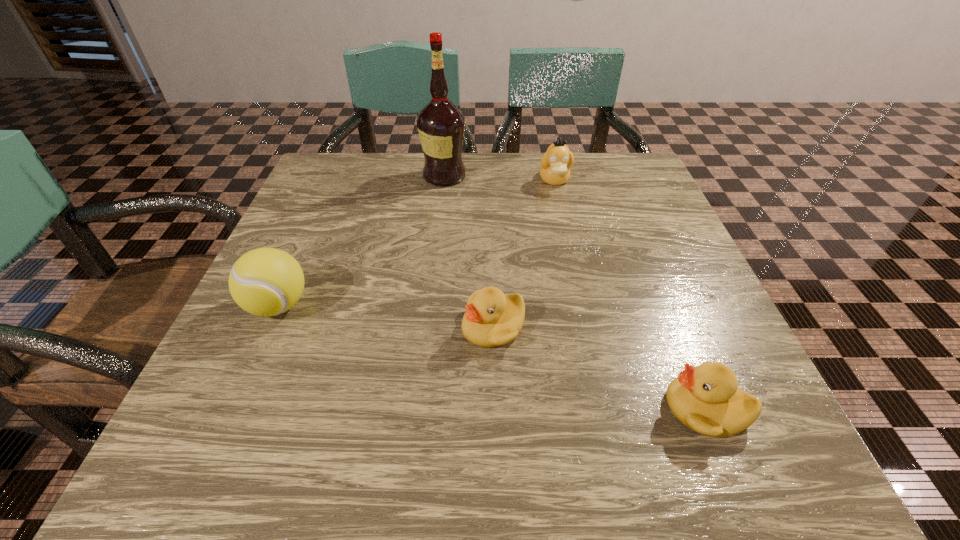
This screenshot has width=960, height=540. I want to click on alcohol, so click(440, 124).

Find the location of a particular element. Image resolution: width=960 pixels, height=540 pixels. the tallest object is located at coordinates (440, 124).

Where is `the leftmost object`? the leftmost object is located at coordinates (266, 281).

Locate an element on the screen. Image resolution: width=960 pixels, height=540 pixels. the tallest duckling is located at coordinates (556, 162).

Find the location of a particular element. This screenshot has width=960, height=540. the farthest duckling is located at coordinates (556, 162).

At what (x,y) coordinates should I click in order to perform the action: click on the second nearest duckling. Please return your answer as a coordinate pair (x, y). The height and width of the screenshot is (540, 960). Looking at the image, I should click on (x=492, y=319).

Where is `the leftmost duckling`? This screenshot has height=540, width=960. the leftmost duckling is located at coordinates (492, 319).

At what (x,y) coordinates should I click in order to perform the action: click on the rightmost object. Please return your answer as a coordinate pair (x, y). This screenshot has height=540, width=960. Looking at the image, I should click on (706, 399).

Locate an element on the screen. The image size is (960, 540). the rightmost duckling is located at coordinates (706, 399).

Locate an element on the screen. The width and height of the screenshot is (960, 540). free space located on the label of the alcohol is located at coordinates (543, 176).